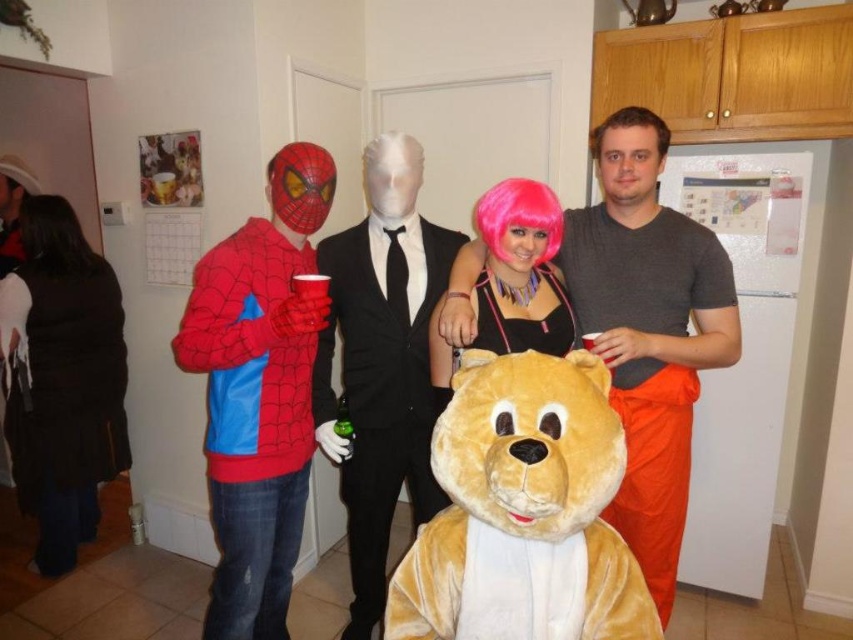
Which of these two, shiny spandex spider-man costume at left or black fuzzy vest at left, stands taller?

black fuzzy vest at left is taller.

Who is lower down, shiny spandex spider-man costume at left or black fuzzy vest at left?

shiny spandex spider-man costume at left

Describe the element at coordinates (259, 392) in the screenshot. This screenshot has height=640, width=853. I see `shiny spandex spider-man costume at left` at that location.

The height and width of the screenshot is (640, 853). I want to click on shiny spandex spider-man costume at left, so 259,392.

Can you confirm if shiny spandex spider-man costume at left is taller than pink wig at center?

Correct, shiny spandex spider-man costume at left is much taller as pink wig at center.

Is shiny spandex spider-man costume at left smaller than pink wig at center?

Actually, shiny spandex spider-man costume at left might be larger than pink wig at center.

Where is `shiny spandex spider-man costume at left`? Image resolution: width=853 pixels, height=640 pixels. shiny spandex spider-man costume at left is located at coordinates (259, 392).

This screenshot has height=640, width=853. Find the location of `shiny spandex spider-man costume at left`. shiny spandex spider-man costume at left is located at coordinates (259, 392).

Who is taller, matte gray t-shirt at center or pink synthetic wig at center?

Standing taller between the two is matte gray t-shirt at center.

At what (x,y) coordinates should I click in order to perform the action: click on matte gray t-shirt at center. Please return your answer as a coordinate pair (x, y). Looking at the image, I should click on (648, 337).